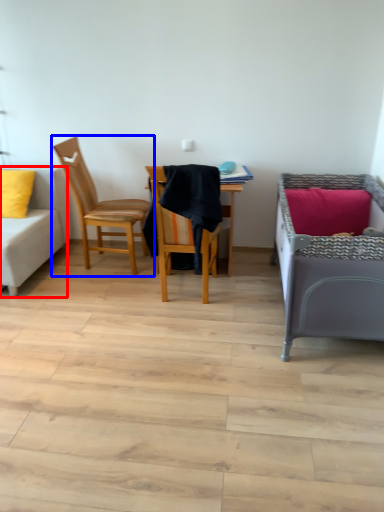
Question: Which object appears closest to the camera in this image, studio couch (highlighted by a red box) or chair (highlighted by a blue box)?

Choices:
 (A) studio couch
 (B) chair

Answer: (A)